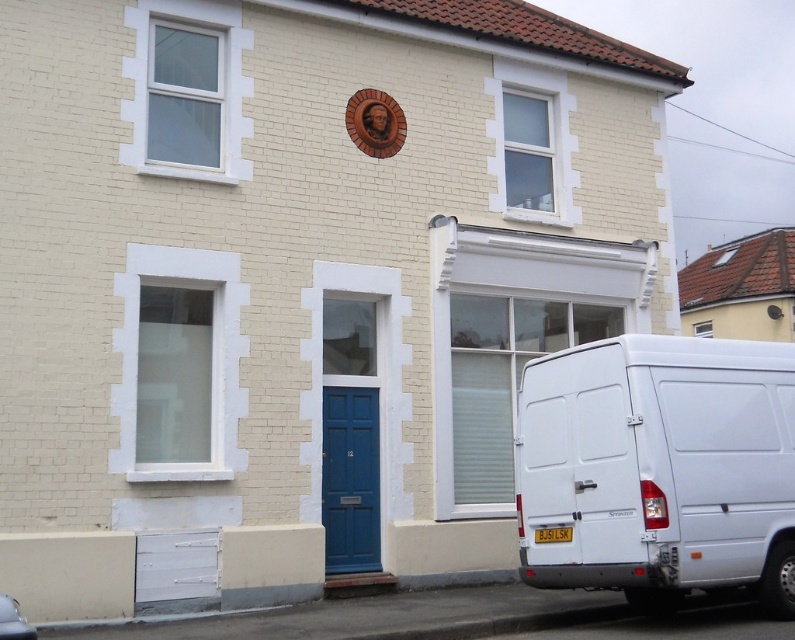
Does white matte van at lower right lie in front of blue painted wood door at center?

Yes, it is.

From the picture: Does white matte van at lower right appear on the left side of blue painted wood door at center?

In fact, white matte van at lower right is to the right of blue painted wood door at center.

Which is behind, point (528, 444) or point (351, 490)?

The point (351, 490) is behind.

The height and width of the screenshot is (640, 795). I want to click on white matte van at lower right, so click(658, 468).